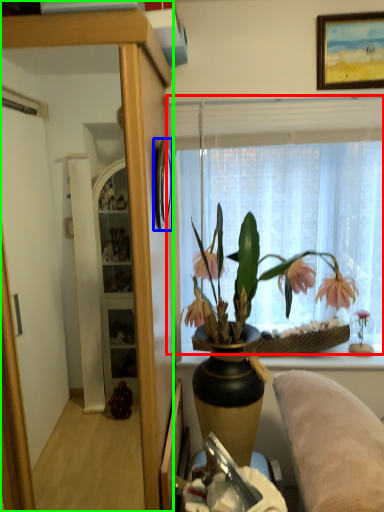
Question: Which is farther away from window (highlighted by a red box)? picture frame (highlighted by a blue box) or cabinetry (highlighted by a green box)?

Choices:
 (A) picture frame
 (B) cabinetry

Answer: (B)